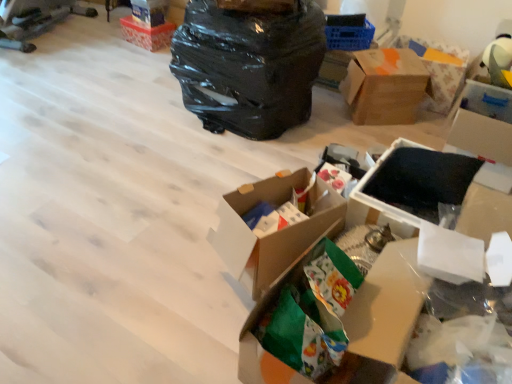
Question: From a real-world perspective, is brown cardboard box at upper right, which appears as the second box when viewed from the top, located higher than orange-patterned cardboard box at upper right?

Choices:
 (A) no
 (B) yes

Answer: (A)

Question: Can you confirm if brown cardboard box at upper right, the 4th box ordered from the bottom, is smaller than orange-patterned cardboard box at upper right?

Choices:
 (A) yes
 (B) no

Answer: (B)

Question: Considering the relative positions of brown cardboard box at upper right, which appears as the second box when viewed from the top, and orange-patterned cardboard box at upper right in the image provided, is brown cardboard box at upper right, which appears as the second box when viewed from the top, in front of orange-patterned cardboard box at upper right?

Choices:
 (A) no
 (B) yes

Answer: (B)

Question: Is brown cardboard box at upper right, the 2th box when ordered from back to front, to the right of orange-patterned cardboard box at upper right from the viewer's perspective?

Choices:
 (A) yes
 (B) no

Answer: (B)

Question: Is brown cardboard box at upper right, which appears as the second box when viewed from the top, positioned with its back to orange-patterned cardboard box at upper right?

Choices:
 (A) yes
 (B) no

Answer: (B)

Question: In terms of height, does orange-patterned cardboard box at upper right look taller or shorter compared to black foam at center, the 2th storage box in the bottom-to-top sequence?

Choices:
 (A) tall
 (B) short

Answer: (A)

Question: Is orange-patterned cardboard box at upper right inside the boundaries of black foam at center, the 3th storage box viewed from the back, or outside?

Choices:
 (A) outside
 (B) inside

Answer: (A)

Question: From a real-world perspective, is orange-patterned cardboard box at upper right positioned above or below black foam at center, the 2th storage box in the bottom-to-top sequence?

Choices:
 (A) below
 (B) above

Answer: (A)

Question: In the image, is orange-patterned cardboard box at upper right positioned in front of or behind black foam at center, the 3th storage box viewed from the back?

Choices:
 (A) front
 (B) behind

Answer: (B)

Question: In the image, is brown cardboard box at upper right, the fourth box positioned from the left, positioned in front of or behind orange-patterned cardboard box at upper right?

Choices:
 (A) behind
 (B) front

Answer: (B)

Question: In terms of width, does brown cardboard box at upper right, the fourth box positioned from the left, look wider or thinner when compared to orange-patterned cardboard box at upper right?

Choices:
 (A) thin
 (B) wide

Answer: (A)

Question: Is point (420, 99) closer or farther from the camera than point (450, 86)?

Choices:
 (A) closer
 (B) farther

Answer: (A)

Question: Is brown cardboard box at upper right, the fourth box positioned from the left, spatially inside orange-patterned cardboard box at upper right, or outside of it?

Choices:
 (A) inside
 (B) outside

Answer: (B)

Question: Considering their positions, is black plastic bag at upper center located in front of or behind orange-patterned cardboard box at upper right?

Choices:
 (A) behind
 (B) front

Answer: (B)

Question: Is point (256, 115) positioned closer to the camera than point (453, 64)?

Choices:
 (A) farther
 (B) closer

Answer: (B)